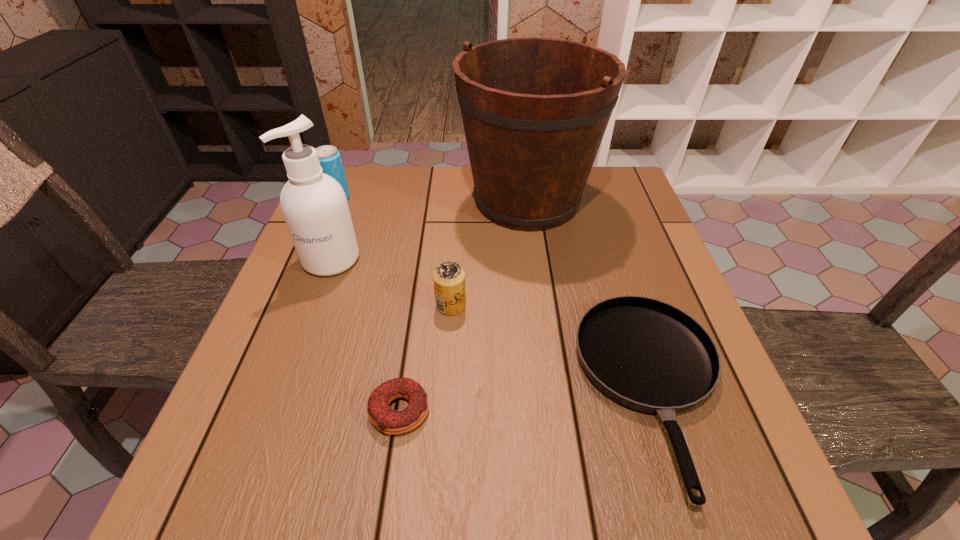
What are the coordinates of `free space that satisfies the following two spatial constraints: 1. on the front side of the third tallest object; 2. on the right side of the bucket` in the screenshot? It's located at (336, 201).